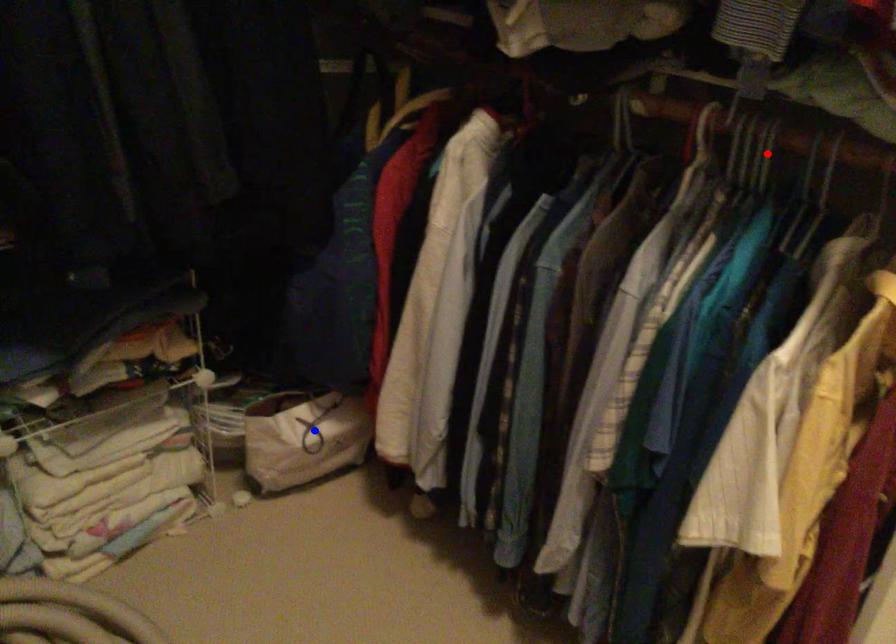
Question: Which of the two points in the image is closer to the camera?

Choices:
 (A) Blue point is closer.
 (B) Red point is closer.

Answer: (B)